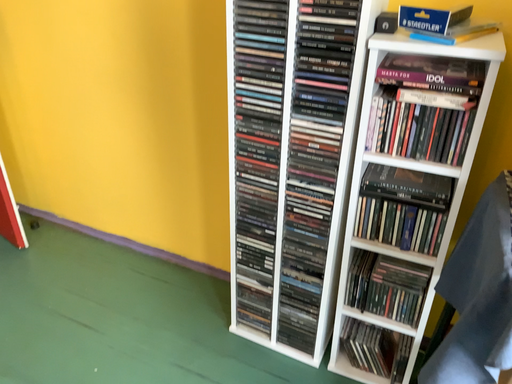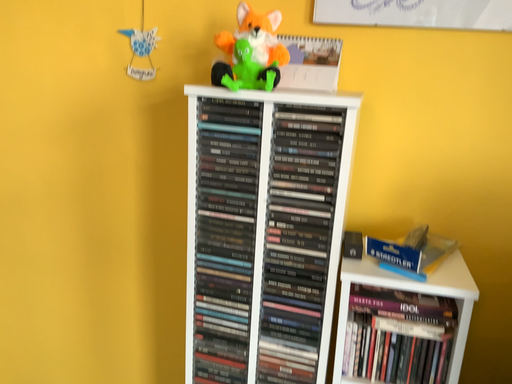
Question: How did the camera likely rotate when shooting the video?

Choices:
 (A) rotated upward
 (B) rotated downward

Answer: (A)